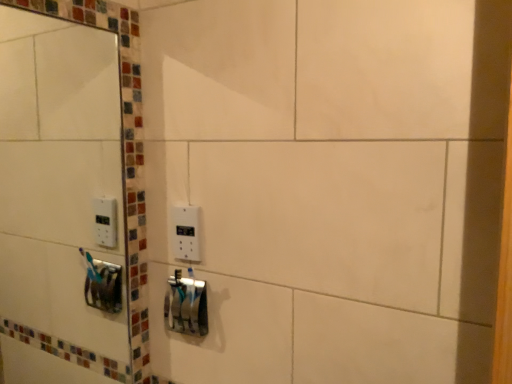
Locate an element on the screen. white plastic light switch at center is located at coordinates (186, 233).

The height and width of the screenshot is (384, 512). Describe the element at coordinates (57, 176) in the screenshot. I see `white glossy mirror at upper left` at that location.

Measure the distance between point (179, 276) and camera.

The depth of point (179, 276) is 3.64 feet.

Locate an element on the screen. The height and width of the screenshot is (384, 512). white plastic light switch at center is located at coordinates (186, 233).

Considering the relative positions of white plastic light switch at center and metallic silver toothbrush holder at center in the image provided, is white plastic light switch at center to the right of metallic silver toothbrush holder at center from the viewer's perspective?

Yes, white plastic light switch at center is to the right of metallic silver toothbrush holder at center.

Is white plastic light switch at center not close to metallic silver toothbrush holder at center?

No, white plastic light switch at center is in close proximity to metallic silver toothbrush holder at center.

Would you say metallic silver toothbrush holder at center is part of white plastic light switch at center's contents?

That's incorrect, metallic silver toothbrush holder at center is not inside white plastic light switch at center.

From a real-world perspective, is metallic silver toothbrush holder at center positioned over white plastic light switch at center based on gravity?

No, from a real-world perspective, metallic silver toothbrush holder at center is not over white plastic light switch at center

What are the coordinates of `light switch behind the metallic silver toothbrush holder at center` in the screenshot? It's located at (186, 233).

Is metallic silver toothbrush holder at center behind white plastic light switch at center?

No, it is not.

Is point (198, 331) closer to camera compared to point (198, 218)?

No, (198, 331) is behind (198, 218).

Is metallic silver toothbrush holder at center with white glossy mirror at upper left?

No, metallic silver toothbrush holder at center is not in contact with white glossy mirror at upper left.

Does metallic silver toothbrush holder at center contain white glossy mirror at upper left?

No, white glossy mirror at upper left is not inside metallic silver toothbrush holder at center.

Which object is closer to the camera taking this photo, metallic silver toothbrush holder at center or white glossy mirror at upper left?

white glossy mirror at upper left is closer to the camera.

From the image's perspective, between metallic silver toothbrush holder at center and white glossy mirror at upper left, who is located below?

From the image's view, metallic silver toothbrush holder at center is below.

Is white glossy mirror at upper left at the left side of white plastic light switch at center?

Indeed, white glossy mirror at upper left is positioned on the left side of white plastic light switch at center.

Is white glossy mirror at upper left outside of white plastic light switch at center?

Yes.

From a real-world perspective, is white glossy mirror at upper left physically below white plastic light switch at center?

Actually, white glossy mirror at upper left is physically above white plastic light switch at center in the real world.

From the image's perspective, which is above, white glossy mirror at upper left or white plastic light switch at center?

From the image's view, white glossy mirror at upper left is above.

Is white plastic light switch at center oriented towards white glossy mirror at upper left?

No.

Is white plastic light switch at center positioned behind white glossy mirror at upper left?

Yes, the depth of white plastic light switch at center is greater than that of white glossy mirror at upper left.

Are white plastic light switch at center and white glossy mirror at upper left located far from each other?

No, there isn't a large distance between white plastic light switch at center and white glossy mirror at upper left.

Can you confirm if white plastic light switch at center is positioned to the right of white glossy mirror at upper left?

Yes, white plastic light switch at center is to the right of white glossy mirror at upper left.

From a real-world perspective, which is physically above, white glossy mirror at upper left or metallic silver toothbrush holder at center?

From a 3D spatial view, white glossy mirror at upper left is above.

What's the angular difference between white glossy mirror at upper left and metallic silver toothbrush holder at center's facing directions?

89.4 degrees.

Considering the relative sizes of white glossy mirror at upper left and metallic silver toothbrush holder at center in the image provided, is white glossy mirror at upper left smaller than metallic silver toothbrush holder at center?

No, white glossy mirror at upper left is not smaller than metallic silver toothbrush holder at center.

Identify the location of lock on the left of white plastic light switch at center. The image size is (512, 384). (186, 305).

I want to click on light switch behind the metallic silver toothbrush holder at center, so click(x=186, y=233).

When comparing their distances from white glossy mirror at upper left, does white plastic light switch at center or metallic silver toothbrush holder at center seem further?

white plastic light switch at center is further to white glossy mirror at upper left.

Looking at the image, which one is located closer to white plastic light switch at center, white glossy mirror at upper left or metallic silver toothbrush holder at center?

Based on the image, metallic silver toothbrush holder at center appears to be nearer to white plastic light switch at center.

Looking at this image, based on their spatial positions, is white glossy mirror at upper left or white plastic light switch at center further from metallic silver toothbrush holder at center?

The object further to metallic silver toothbrush holder at center is white glossy mirror at upper left.

Considering their positions, is metallic silver toothbrush holder at center positioned further to white glossy mirror at upper left than white plastic light switch at center?

white plastic light switch at center.

Considering their positions, is metallic silver toothbrush holder at center positioned closer to white plastic light switch at center than white glossy mirror at upper left?

The object closer to white plastic light switch at center is metallic silver toothbrush holder at center.

Estimate the real-world distances between objects in this image. Which object is closer to metallic silver toothbrush holder at center, white plastic light switch at center or white glossy mirror at upper left?

white plastic light switch at center.

Where is `lock between white glossy mirror at upper left and white plastic light switch at center along the z-axis`? This screenshot has width=512, height=384. lock between white glossy mirror at upper left and white plastic light switch at center along the z-axis is located at coordinates (186, 305).